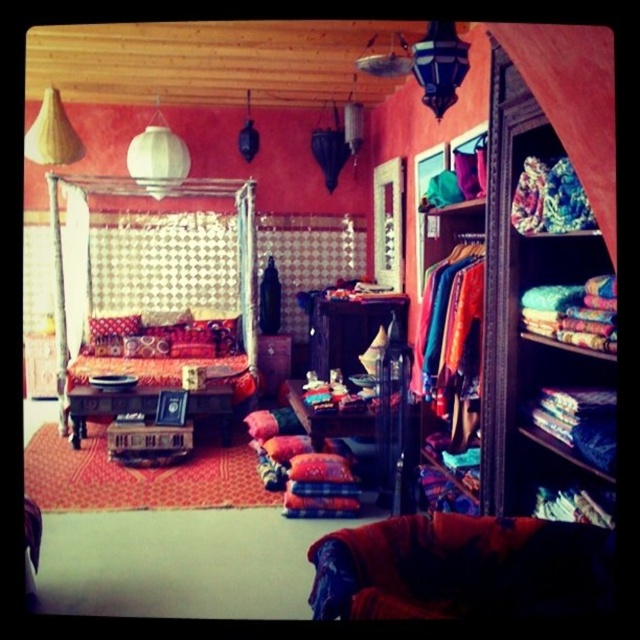
You are standing at the entrance of the room and want to hang a new painting. The painting is meant to be placed above the white sheer curtain at left. However, there is already the textured fabric bed at center in that area. Can the painting be placed there without overlapping the bed?

The textured fabric bed at center is already positioned above the white sheer curtain at left, so placing the painting there would cause overlap with the bed. Choose another location for the painting.

You are standing in the room and want to hang a large painting. The painting is 2 meters tall. You have two options to hang it on the wall behind either the textured fabric bed at center or the white sheer curtain at left. Based on the height of the objects, which location would allow the painting to fit without touching the top of the object?

The painting should be hung behind the textured fabric bed at center because it is much taller than the white sheer curtain at left, providing enough vertical space to accommodate the 2 meter tall painting without touching the top of the bed.

You are planning to redecorate your room and want to know if the textured fabric bed at center can be moved closer to the white sheer curtain at left without overlapping. Based on their sizes, is this possible?

The textured fabric bed at center is bigger than the white sheer curtain at left, so there might be limited space to move it closer without overlapping. Consider the size difference when planning the arrangement.